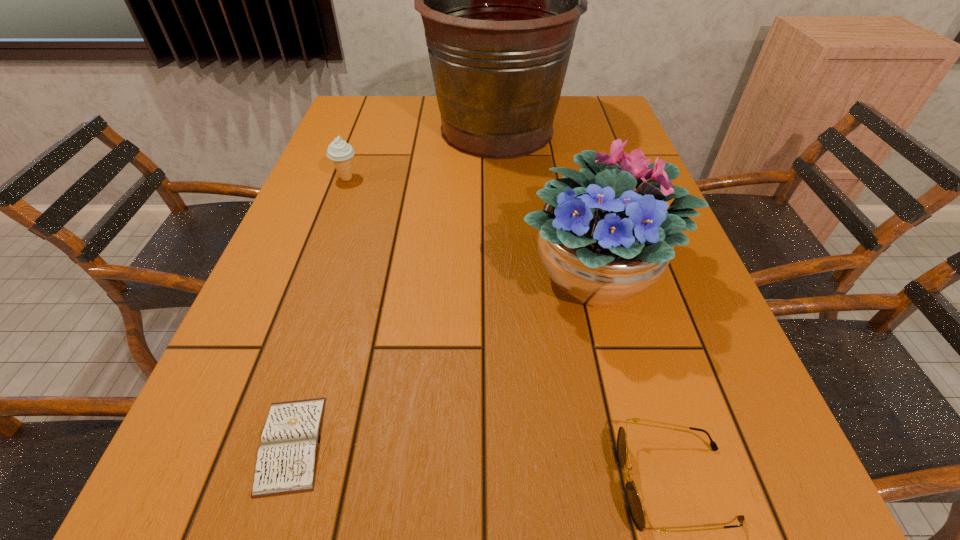
This screenshot has height=540, width=960. What are the coordinates of `vacant region at the far left corner of the desktop` in the screenshot? It's located at (394, 96).

The image size is (960, 540). I want to click on vacant region at the near left corner of the desktop, so click(261, 514).

Image resolution: width=960 pixels, height=540 pixels. I want to click on blank space at the far right corner of the desktop, so tap(622, 123).

This screenshot has width=960, height=540. In order to click on vacant area that lies between the third nearest object and the shortest object in this screenshot , I will do `click(444, 358)`.

The image size is (960, 540). I want to click on vacant space in between the second tallest object and the shortest object, so click(x=444, y=358).

Identify the location of free point between the diary and the third shortest object. The width and height of the screenshot is (960, 540). (320, 312).

Identify the location of free point between the bucket and the third shortest object. (422, 154).

I want to click on unoccupied area between the third tallest object and the farthest object, so click(x=422, y=154).

Locate an element on the screen. This screenshot has width=960, height=540. vacant space that's between the tallest object and the second farthest object is located at coordinates (422, 154).

Find the location of a particular element. The image size is (960, 540). vacant space in between the shortest object and the fourth shortest object is located at coordinates (444, 358).